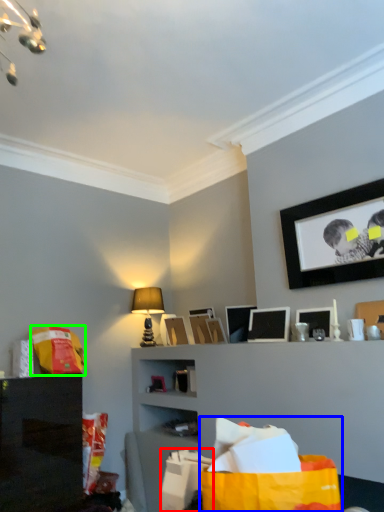
Question: Which is nearer to the shopping bag (highlighted by a red box)? shopping bag (highlighted by a blue box) or shopping bag (highlighted by a green box).

Choices:
 (A) shopping bag
 (B) shopping bag

Answer: (A)